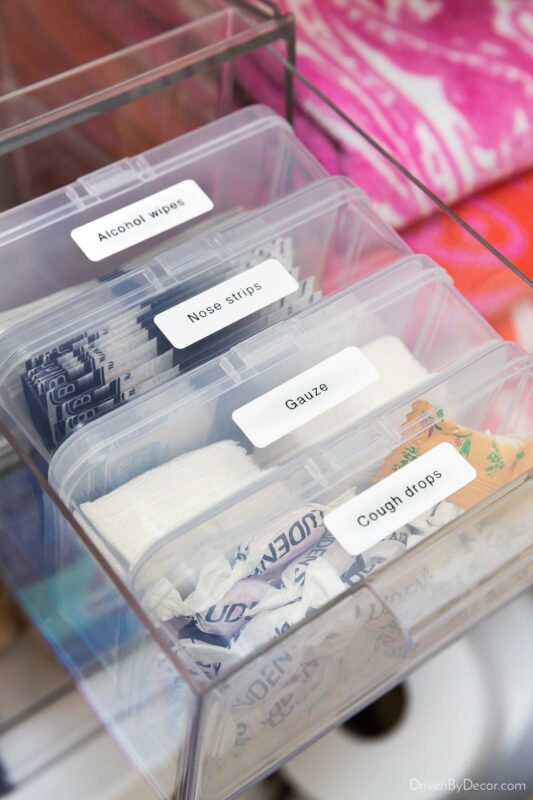
At what (x,y) coordinates should I click in order to perform the action: click on towels. Please return your answer as a coordinate pair (x, y). This screenshot has height=800, width=533. Looking at the image, I should click on (455, 164), (500, 220).